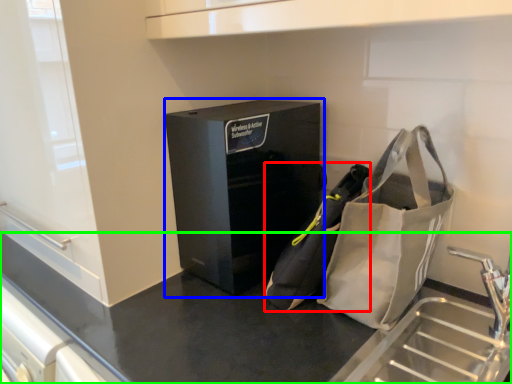
Question: Which object is positioned closest to pouch (highlighted by a red box)? Select from furniture (highlighted by a blue box) and counter (highlighted by a green box).

Choices:
 (A) furniture
 (B) counter

Answer: (A)